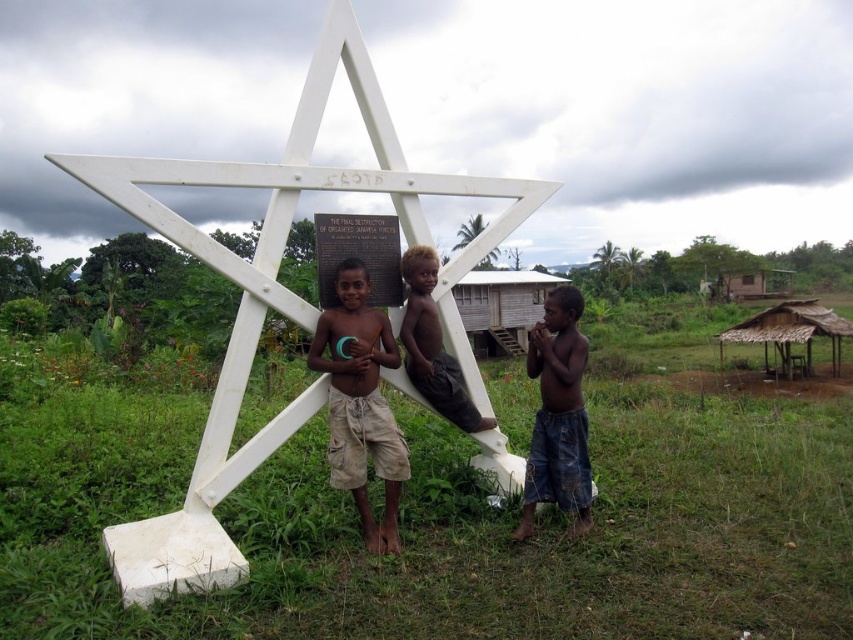
Question: Can you confirm if white matte star at center is positioned below blue denim shorts at lower right?

Choices:
 (A) yes
 (B) no

Answer: (B)

Question: Which object is closer to the camera taking this photo?

Choices:
 (A) wooden hut at center
 (B) blue denim shorts at lower right
 (C) white matte star at center

Answer: (B)

Question: Can you confirm if beige cotton shorts at center is positioned above wooden hut at center?

Choices:
 (A) no
 (B) yes

Answer: (A)

Question: Which of the following is the farthest from the observer?

Choices:
 (A) beige cotton shorts at center
 (B) wooden hut at center
 (C) blue denim shorts at lower right
 (D) light brown skin at center

Answer: (B)

Question: Estimate the real-world distances between objects in this image. Which object is closer to the beige cotton shorts at center?

Choices:
 (A) thatched straw hut at lower right
 (B) brown wooden hut at right
 (C) wooden hut at center
 (D) white matte star at center

Answer: (D)

Question: Can you confirm if white matte star at center is positioned below brown wooden hut at right?

Choices:
 (A) no
 (B) yes

Answer: (B)